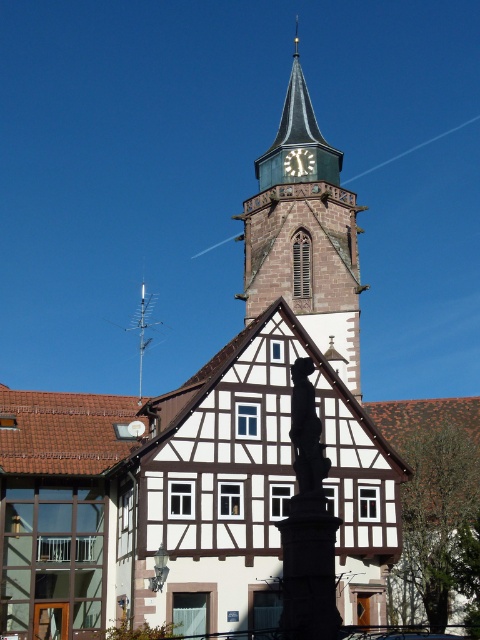
Between smooth gray stone clock tower at center and white wooden clock at upper center, which one appears on the right side from the viewer's perspective?

Positioned to the right is white wooden clock at upper center.

From the picture: Measure the distance between smooth gray stone clock tower at center and camera.

smooth gray stone clock tower at center is 65.58 meters from camera.

Locate an element on the screen. smooth gray stone clock tower at center is located at coordinates (304, 237).

Can you confirm if silver metallic antenna at upper center is shorter than white wooden clock at upper center?

Incorrect, silver metallic antenna at upper center's height does not fall short of white wooden clock at upper center's.

You are a GUI agent. You are given a task and a screenshot of the screen. Output one action in this format:
    pyautogui.click(x=<x>, y=<y>)
    Task: Click on the silver metallic antenna at upper center
    The width and height of the screenshot is (480, 640).
    Given the screenshot: What is the action you would take?
    pyautogui.click(x=143, y=328)

Does smooth gray stone clock tower at center have a lesser width compared to silver metallic antenna at upper center?

Yes.

Which is in front, point (320, 188) or point (149, 304)?

Point (320, 188) is in front.

Who is more distant from viewer, (264, 224) or (131, 324)?

The point (131, 324) is more distant.

What are the coordinates of `smooth gray stone clock tower at center` in the screenshot? It's located at (304, 237).